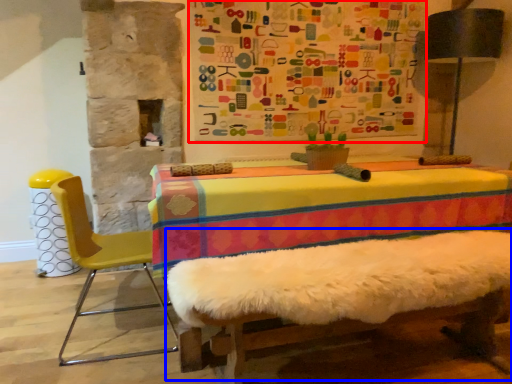
Question: Which point is closer to the camera, bulletin board (highlighted by a red box) or bed frame (highlighted by a blue box)?

Choices:
 (A) bulletin board
 (B) bed frame

Answer: (B)